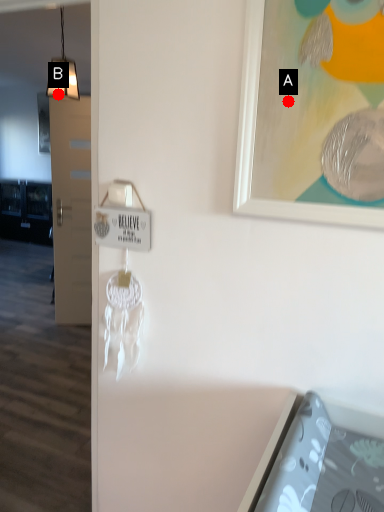
Question: Two points are circled on the image, labeled by A and B beside each circle. Which point appears closest to the camera in this image?

Choices:
 (A) A is closer
 (B) B is closer

Answer: (A)